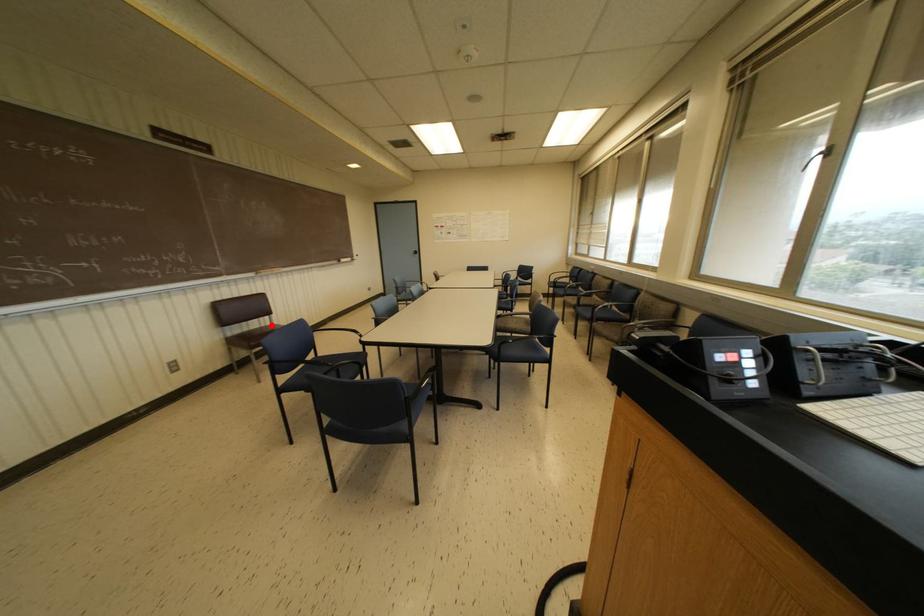
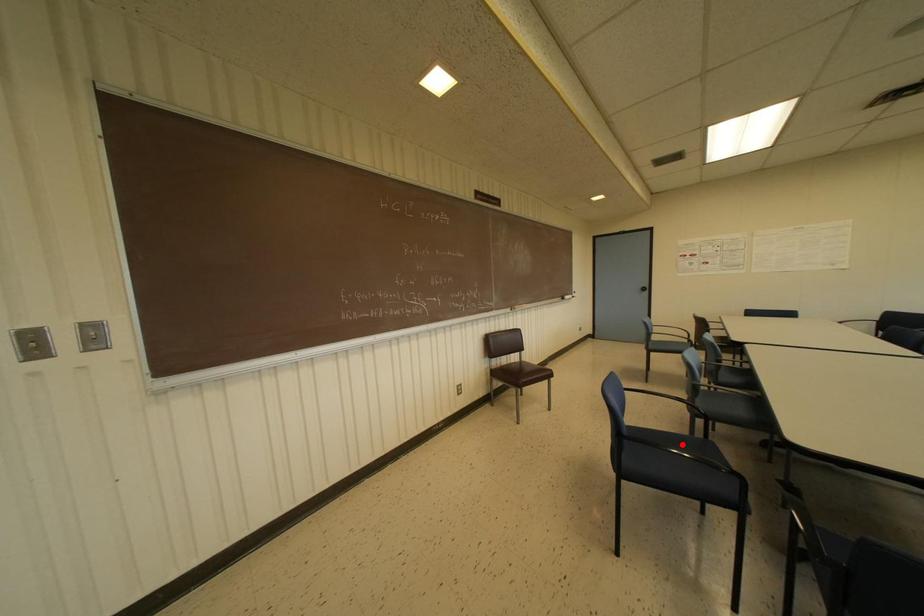
From the picture: I am providing you with two images of the same scene from different viewpoints. A red point is marked on the first image and another point is marked on the second image. Is the marked point in image1 the same physical position as the marked point in image2?

No